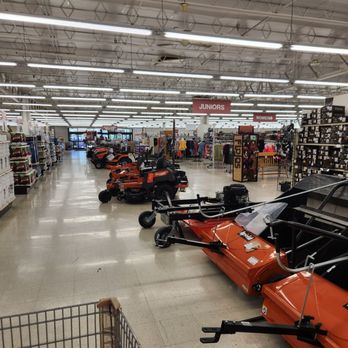
Locate an element on the screen. Image resolution: width=348 pixels, height=348 pixels. shoeboxes on top shelf is located at coordinates (315, 108), (315, 113), (315, 120), (325, 108), (325, 112), (325, 117), (325, 120), (306, 120), (307, 115).